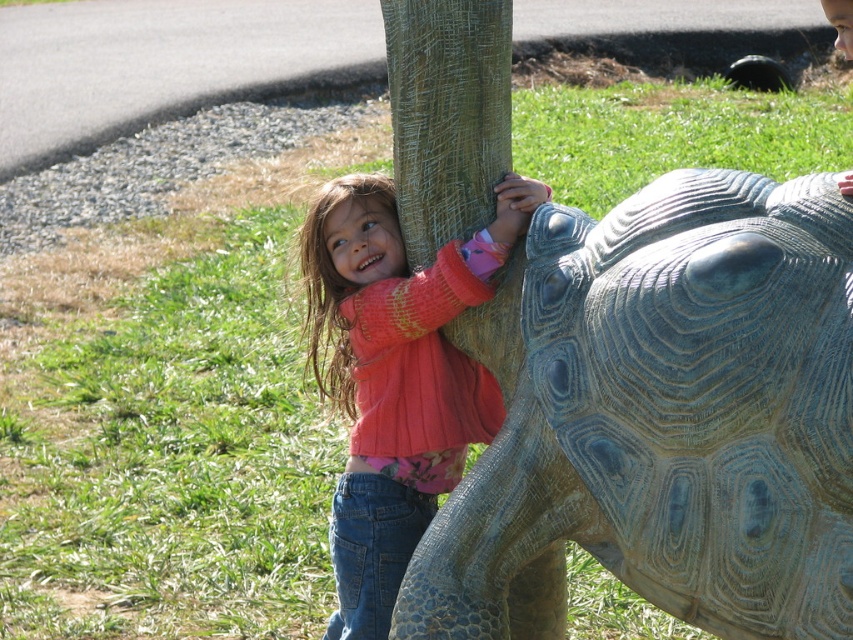
You are a photographer trying to capture the girl in the pink sweater at center and the green textured tortoise at center. Which object is located to the right of the other?

The green textured tortoise at center is positioned on the right side of pink sweater at center.

You are standing in a park and want to take a photo of the girl climbing the turtle sculpture. The camera you have can focus on objects within 2 meters. Is the point at coordinates point [776,285] within the camera focus range?

The distance of point [776,285] from viewer is 2.32 meters, which is beyond the camera focus range of 2 meters. Therefore, the point is out of focus range.

You are a photographer trying to capture the girl and the sculpture in a single shot. Given that the green textured tortoise at center is shorter than the pink sweater at center, which object should you focus on first to ensure both are in frame?

The green textured tortoise at center is shorter than the pink sweater at center, so you should focus on the pink sweater at center first to ensure both are in frame.